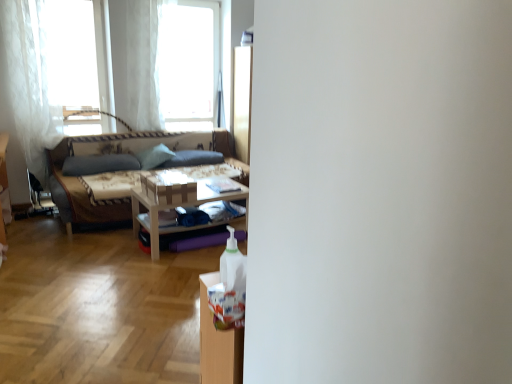
Find the location of `free point below white sheer curtain at upper left, which appears as the second curtain when viewed from the left (from a real-world perspective)`. free point below white sheer curtain at upper left, which appears as the second curtain when viewed from the left (from a real-world perspective) is located at coordinates (160, 134).